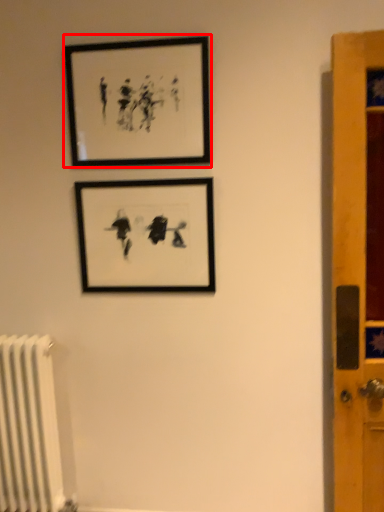
Question: Where is picture frame (annotated by the red box) located in relation to picture frame in the image?

Choices:
 (A) right
 (B) left

Answer: (B)